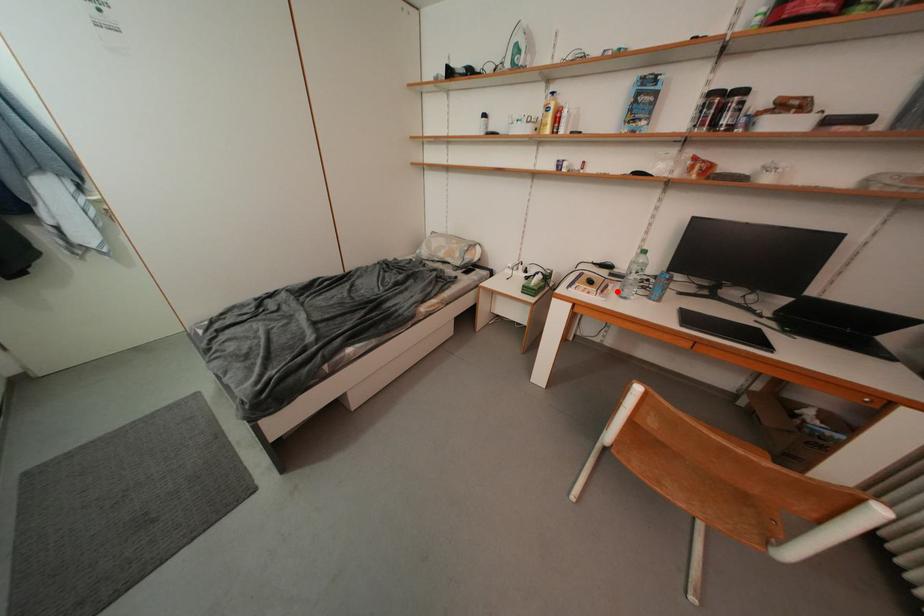
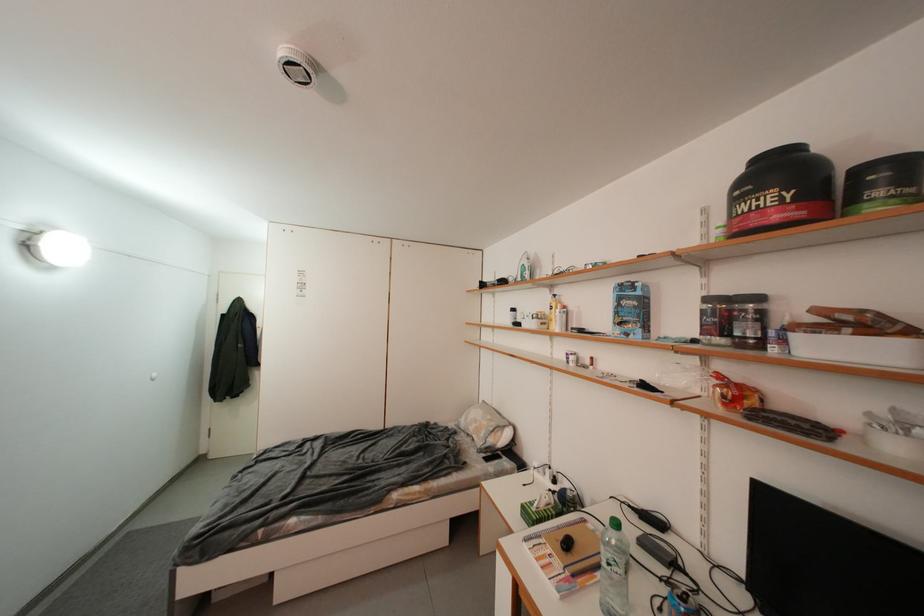
Locate, in the second image, the point that corresponds to the highlighted location in the first image.

(606, 578)